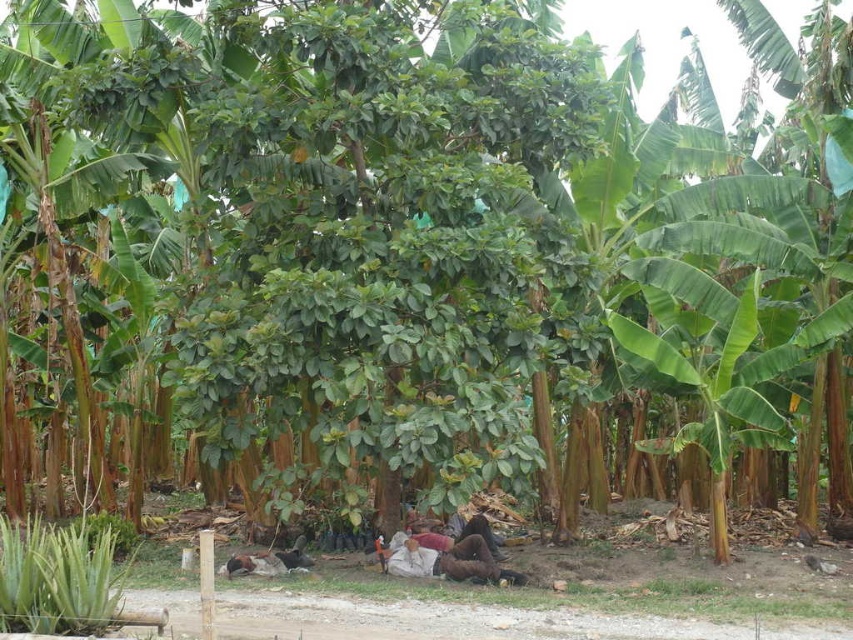
You are planning to place a new small statue in the tropical scene. The statue is 1 meter wide. You have two options for placement spots near the green leafy plant at lower left and the brown fabric person at center. Which location would allow the statue to fit without overlapping either object?

The green leafy plant at lower left is thinner than the brown fabric person at center. Since the statue is 1 meter wide, it should be placed near the green leafy plant at lower left because it has more space around it compared to the brown fabric person at center.

From the picture: You are a hiker who wants to take a photo of the green leafy plant at lower left from where you are standing. Can you reach the plant without moving from your current position if your longest arm span is 6 feet?

The green leafy plant at lower left is 21.96 feet away from you. Since your arm span is only 6 feet, you cannot reach it without moving closer.

You are a delivery person who needs to place a package between the green leafy plant at lower left and the brown fabric person at center. The package requires a space of 5 meters. Can you fit it there?

The distance between the green leafy plant at lower left and the brown fabric person at center is 4.78 meters, which is shorter than the required 5 meters. Therefore, the package cannot be placed there.